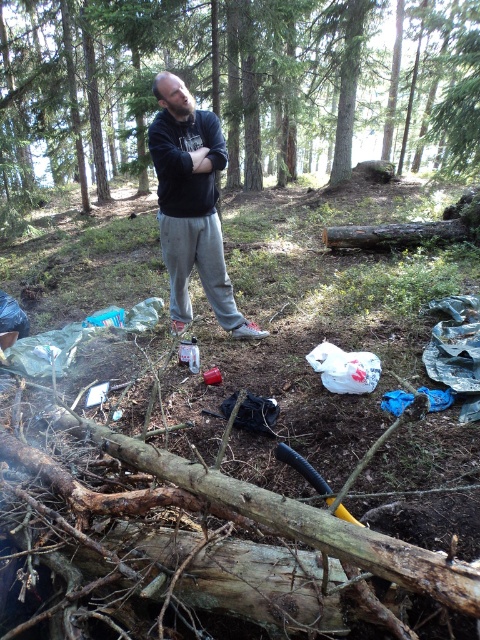
You are navigating through the forest and need to reach a specific location. You notice two points marked in the scene. Which point is closer to you, point [147,38] or point [166,262]?

Point [147,38] is closer to you because it is further to the viewer than point [166,262].

Based on the coordinates provided, where is the green matte tree at center located in the image?

The green matte tree at center is located at the coordinates point (237, 84).